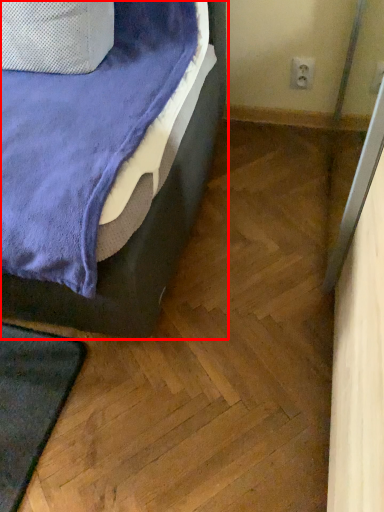
Question: From the image's perspective, where is bed (annotated by the red box) located in relation to electric outlet in the image?

Choices:
 (A) below
 (B) above

Answer: (A)